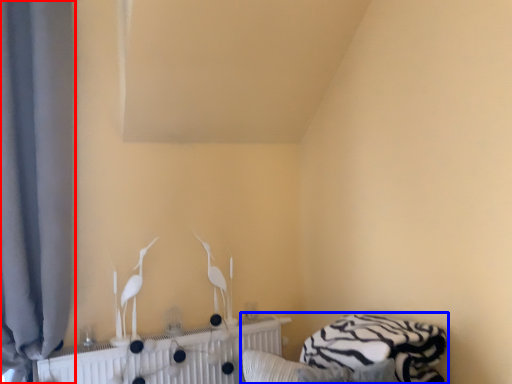
Question: Which object appears closest to the camera in this image, curtain (highlighted by a red box) or bed (highlighted by a blue box)?

Choices:
 (A) curtain
 (B) bed

Answer: (B)